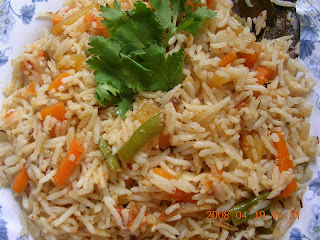
Image resolution: width=320 pixels, height=240 pixels. Find the location of `blue and white tablecloth`. blue and white tablecloth is located at coordinates (308, 65).